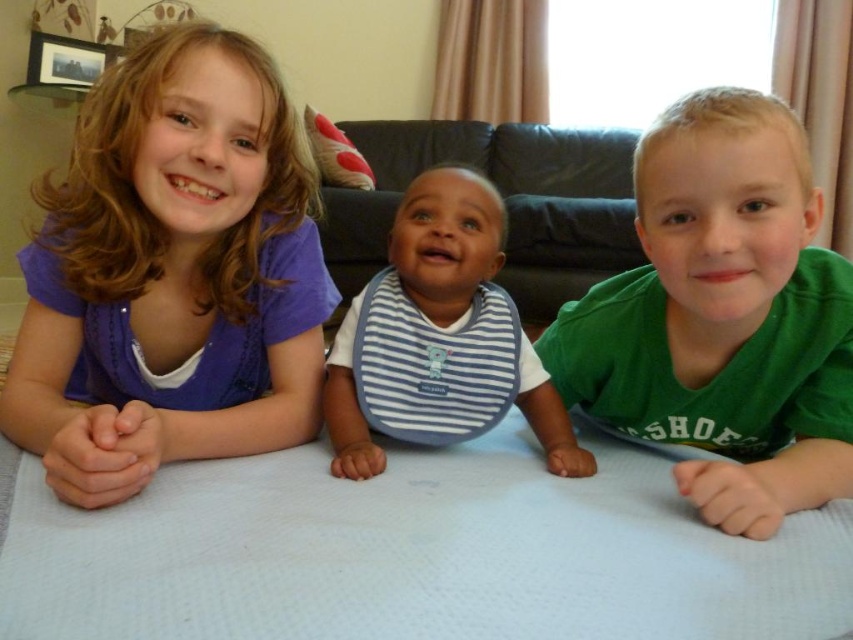
Looking at this image, you are a parent looking at the image of your children. You need to place a toy between the purple fabric shirt at left and the green cotton shirt at right. Based on their positions, where should you place the toy so it is between them?

The purple fabric shirt at left is located above the green cotton shirt at right, so placing the toy between them would require positioning it below the purple fabric shirt at left and above the green cotton shirt at right.

You are a parent trying to dress your children. You have two shirts available, the purple fabric shirt at left and the green cotton shirt at right. Which shirt should you choose if you need the larger one?

The purple fabric shirt at left is bigger than the green cotton shirt at right, so you should choose the purple fabric shirt at left.

You are helping to organize a playroom and need to place the green cotton shirt at right and the black leather couch at center. Based on their sizes, which object should be placed in a smaller space?

The green cotton shirt at right has a smaller width than the black leather couch at center, so it should be placed in the smaller space.